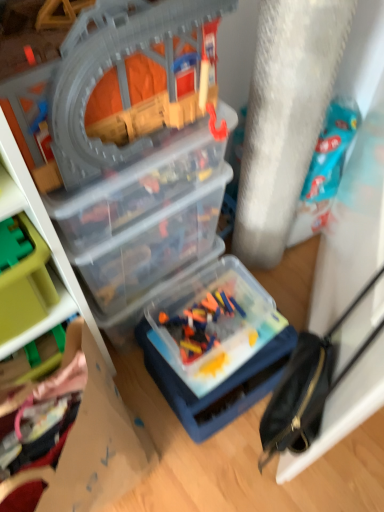
Question: Is transparent plastic toy box at upper left, the 1th box when ordered from front to back, located outside translucent plastic container at center, the 2th toy from the bottom?

Choices:
 (A) yes
 (B) no

Answer: (A)

Question: Is transparent plastic toy box at upper left, the 1th box when ordered from front to back, touching translucent plastic container at center, the 2th toy from the bottom?

Choices:
 (A) yes
 (B) no

Answer: (B)

Question: Is transparent plastic toy box at upper left, arranged as the second box when viewed from the back, positioned in front of translucent plastic container at center, the 2th toy from the bottom?

Choices:
 (A) yes
 (B) no

Answer: (A)

Question: From the image's perspective, would you say transparent plastic toy box at upper left, arranged as the second box when viewed from the back, is positioned over translucent plastic container at center, the 2th toy from the bottom?

Choices:
 (A) yes
 (B) no

Answer: (A)

Question: Is transparent plastic toy box at upper left, the 1th box when ordered from front to back, smaller than translucent plastic container at center, the 2th toy from the bottom?

Choices:
 (A) yes
 (B) no

Answer: (A)

Question: Considering the positions of point pyautogui.click(x=165, y=79) and point pyautogui.click(x=304, y=330), is point pyautogui.click(x=165, y=79) closer or farther from the camera than point pyautogui.click(x=304, y=330)?

Choices:
 (A) farther
 (B) closer

Answer: (B)

Question: Which is correct: transparent plastic train set at upper left, the first toy from the top, is inside black leather bag at right, or outside of it?

Choices:
 (A) outside
 (B) inside

Answer: (A)

Question: From a real-world perspective, is transparent plastic train set at upper left, which is the fifth toy from bottom to top, physically located above or below black leather bag at right?

Choices:
 (A) below
 (B) above

Answer: (B)

Question: Considering their positions, is transparent plastic train set at upper left, the first toy from the top, located in front of or behind black leather bag at right?

Choices:
 (A) behind
 (B) front

Answer: (A)

Question: Is point (226, 272) positioned closer to the camera than point (31, 117)?

Choices:
 (A) farther
 (B) closer

Answer: (A)

Question: In terms of width, does translucent plastic container at center, the 2th toy from the bottom, look wider or thinner when compared to transparent plastic train set at upper left, the first toy from the top?

Choices:
 (A) wide
 (B) thin

Answer: (A)

Question: Considering the positions of translucent plastic container at center, the 2th toy from the bottom, and transparent plastic train set at upper left, which is the fifth toy from bottom to top, in the image, is translucent plastic container at center, the 2th toy from the bottom, bigger or smaller than transparent plastic train set at upper left, which is the fifth toy from bottom to top,?

Choices:
 (A) small
 (B) big

Answer: (A)

Question: In the image, is translucent plastic container at center, placed as the fourth toy when sorted from top to bottom, positioned in front of or behind transparent plastic train set at upper left, the first toy from the top?

Choices:
 (A) front
 (B) behind

Answer: (B)

Question: From the image's perspective, is plush pink blanket at lower left, which appears as the fifth toy when viewed from the top, positioned above or below green plastic toy at left, which is counted as the third toy, starting from the top?

Choices:
 (A) above
 (B) below

Answer: (B)

Question: Is point (38, 482) positioned closer to the camera than point (26, 238)?

Choices:
 (A) closer
 (B) farther

Answer: (B)